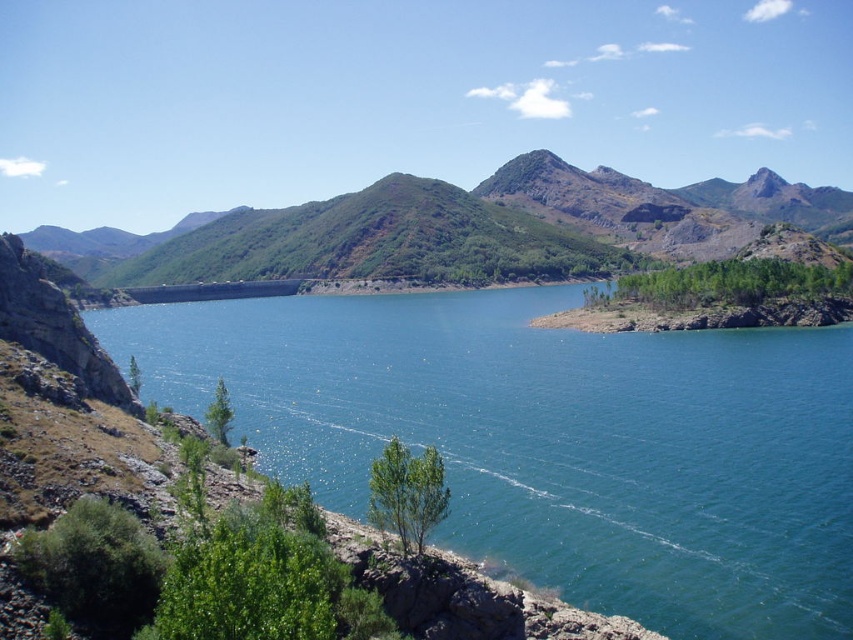
You are a hiker standing at the edge of the blue water at center and want to reach the green textured mountain at center. Which direction should you move to ascend towards the mountain?

The green textured mountain at center is taller than the blue water at center, so you should move towards the green textured mountain at center to ascend.

You are standing at point A located at coordinates (550,440) in the image. What is the immediate environment around your current position?

The immediate environment around point A at coordinates (550,440) is blue water at center.

You are planning to take a photo of the blue water at center and the green textured mountain at center. Which object should you focus on first if you want to capture both in the same frame without moving the camera?

You should focus on the green textured mountain at center first because it is larger than the blue water at center, allowing you to frame both effectively.